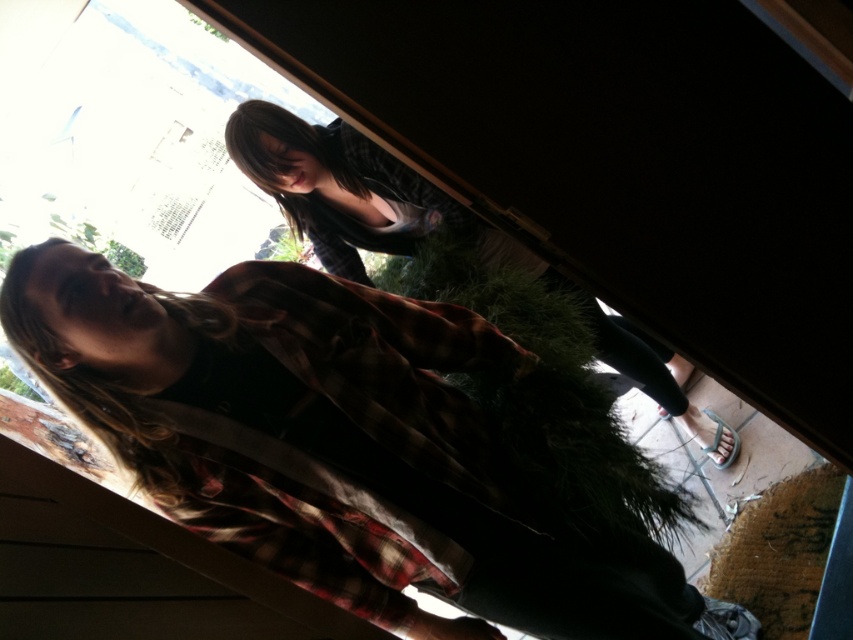
This screenshot has width=853, height=640. What do you see at coordinates (334, 445) in the screenshot?
I see `flannel shirt at center` at bounding box center [334, 445].

Can you confirm if flannel shirt at center is wider than plaid flannel shirt at center?

Incorrect, flannel shirt at center's width does not surpass plaid flannel shirt at center's.

What do you see at coordinates (334, 445) in the screenshot?
I see `flannel shirt at center` at bounding box center [334, 445].

This screenshot has width=853, height=640. What are the coordinates of `flannel shirt at center` in the screenshot? It's located at (334, 445).